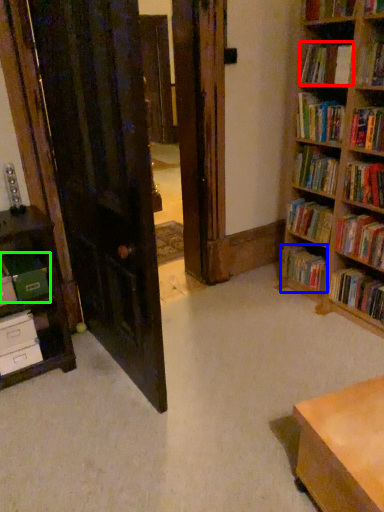
Question: Estimate the real-world distances between objects in this image. Which object is farther from book (highlighted by a red box), book (highlighted by a blue box) or paperback book (highlighted by a green box)?

Choices:
 (A) book
 (B) paperback book

Answer: (B)